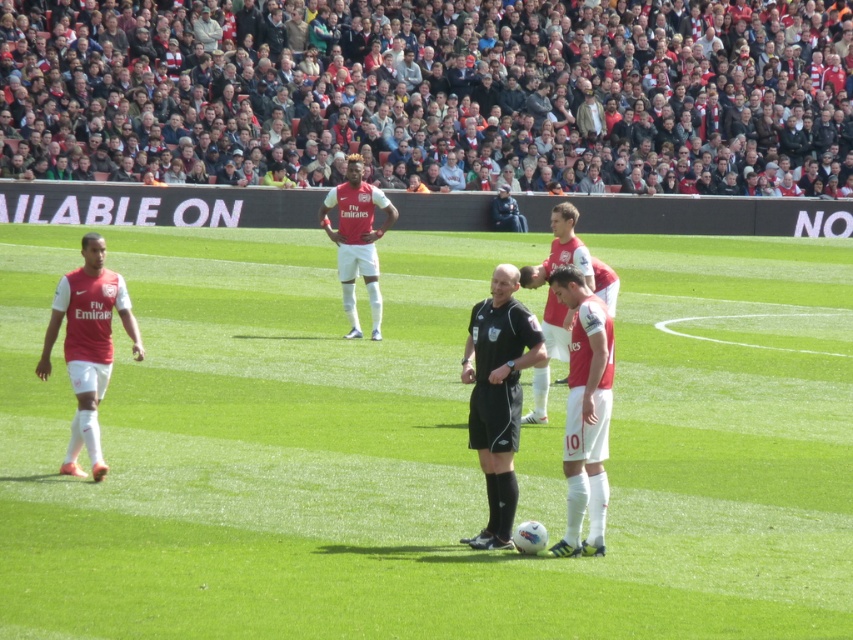
You are a photographer at the soccer match. You want to take a photo of the matte red jersey at left. Where should you aim your camera to capture it?

You should aim your camera at point coordinates of 0.539 on the x axis and 0.104 on the y axis to capture the matte red jersey at left.

You are a soccer player wearing a matte red jersey at left. You need to pass the ball to your teammate located at point (88, 344). Is this point on the left side of the field?

The point (88, 344) indicates the location of the matte red jersey at left, so yes, the point is on the left side of the field.